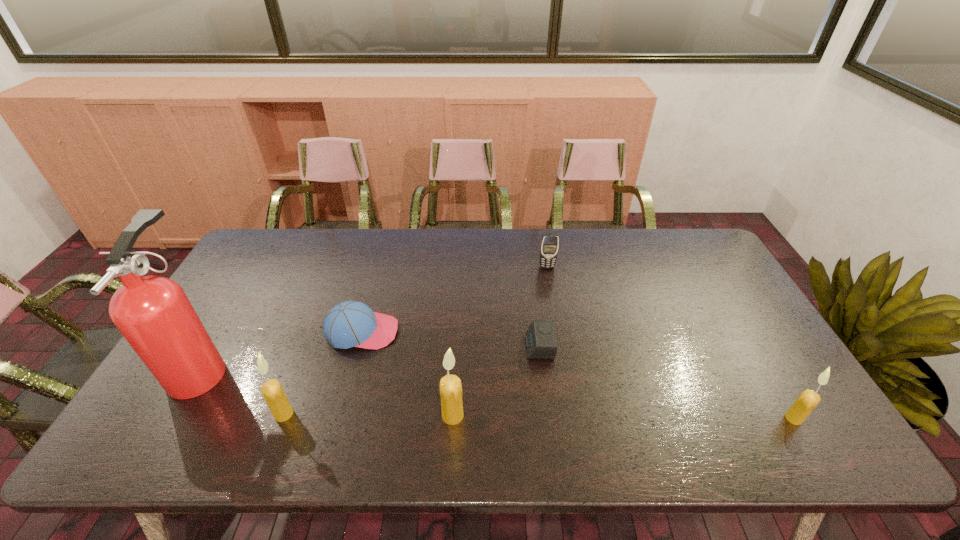
This screenshot has height=540, width=960. Find the location of `vacant position for inserting another candle evenly`. vacant position for inserting another candle evenly is located at coordinates (623, 417).